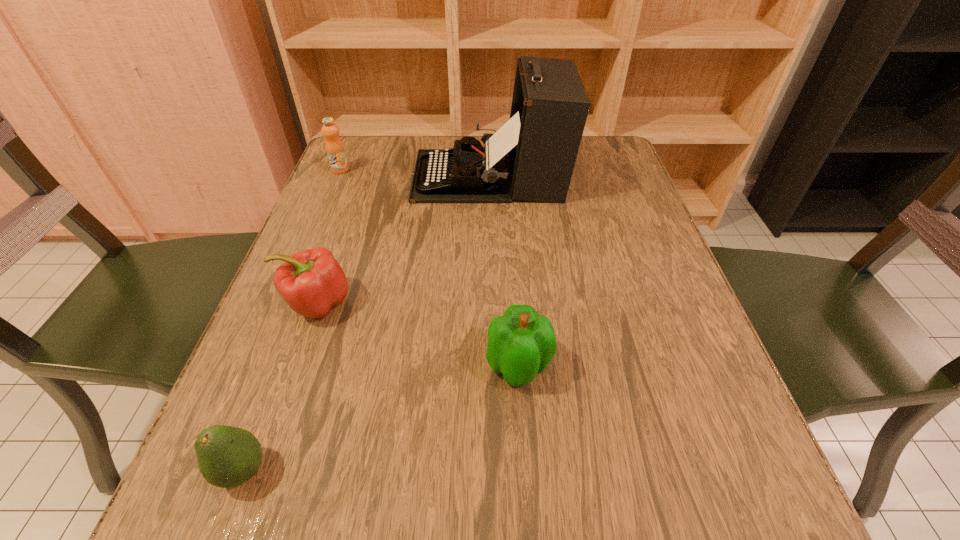
At what (x,y) coordinates should I click in order to perform the action: click on vacant space that satisfies the following two spatial constraints: 1. on the front label of the fourth farthest object; 2. on the left side of the orange juice. Please return your answer as a coordinate pair (x, y). Looking at the image, I should click on (258, 366).

Identify the location of free point that satisfies the following two spatial constraints: 1. on the back side of the farther bell pepper; 2. on the left side of the avocado. The image size is (960, 540). (306, 303).